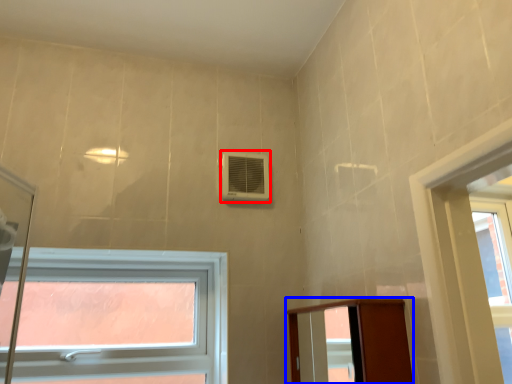
Question: Which object is closer to the camera taking this photo, air conditioning (highlighted by a red box) or elevator (highlighted by a blue box)?

Choices:
 (A) air conditioning
 (B) elevator

Answer: (B)